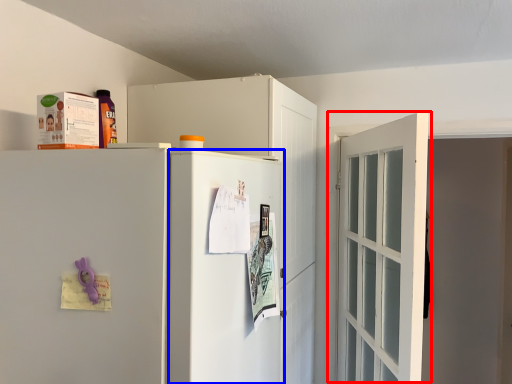
Question: Which of the following is the closest to the observer, door (highlighted by a red box) or screen door (highlighted by a blue box)?

Choices:
 (A) door
 (B) screen door

Answer: (B)